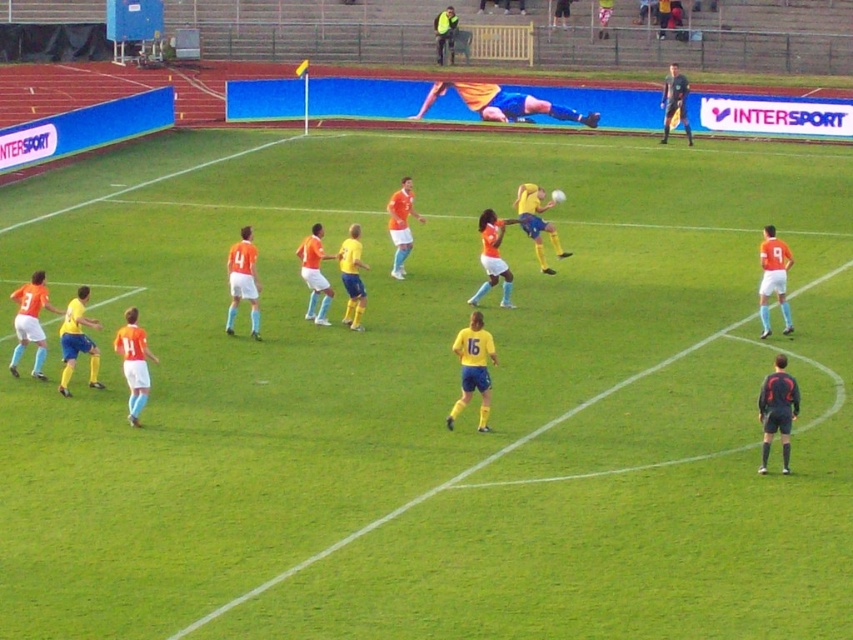
Which is more to the right, black jersey at right or orange matte jersey at left?

black jersey at right is more to the right.

Can you confirm if black jersey at right is smaller than orange matte jersey at left?

Indeed, black jersey at right has a smaller size compared to orange matte jersey at left.

What do you see at coordinates (776, 410) in the screenshot? The image size is (853, 640). I see `black jersey at right` at bounding box center [776, 410].

Identify the location of black jersey at right. (776, 410).

Does yellow matte jersey at center have a larger size compared to yellow jersey at upper center?

No, yellow matte jersey at center is not bigger than yellow jersey at upper center.

Who is higher up, yellow matte jersey at center or yellow jersey at upper center?

Positioned higher is yellow jersey at upper center.

The height and width of the screenshot is (640, 853). What do you see at coordinates (473, 369) in the screenshot?
I see `yellow matte jersey at center` at bounding box center [473, 369].

Where is `yellow matte jersey at center`? The height and width of the screenshot is (640, 853). yellow matte jersey at center is located at coordinates (473, 369).

Does orange matte jersey at left appear on the left side of yellow jersey at upper center?

Yes, orange matte jersey at left is to the left of yellow jersey at upper center.

Is point (135, 372) positioned before point (438, 45)?

Yes, point (135, 372) is closer to viewer.

You are a GUI agent. You are given a task and a screenshot of the screen. Output one action in this format:
    pyautogui.click(x=<x>, y=<y>)
    Task: Click on the orange matte jersey at left
    The image size is (853, 640).
    Given the screenshot: What is the action you would take?
    pyautogui.click(x=132, y=362)